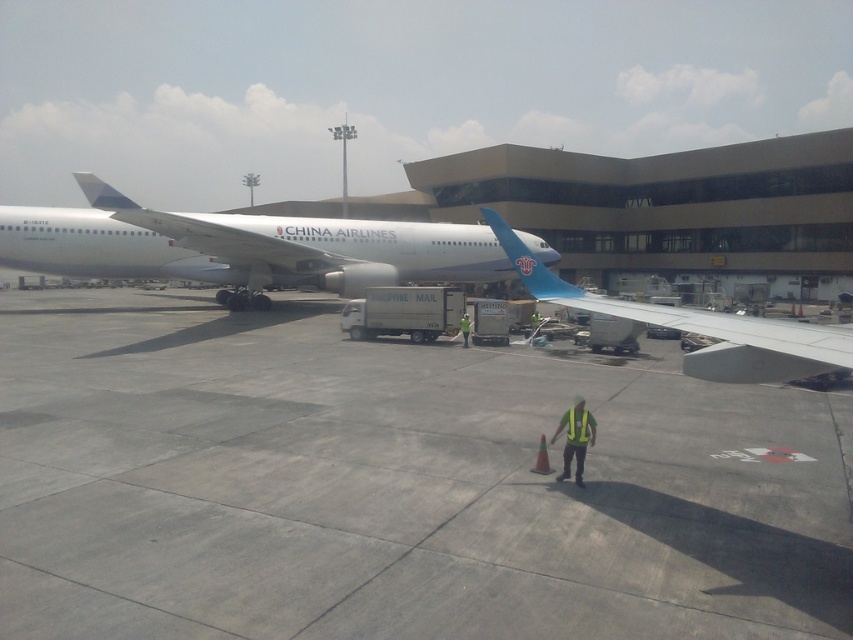
Question: Can you confirm if gray concrete tarmac at center is positioned above white glossy airplane at center?

Choices:
 (A) no
 (B) yes

Answer: (A)

Question: Among these objects, which one is nearest to the camera?

Choices:
 (A) white glossy airplane at center
 (B) green reflective vest at center
 (C) blue glossy wing at center
 (D) gray concrete tarmac at center

Answer: (C)

Question: Which of the following is the farthest from the observer?

Choices:
 (A) yellow reflective safety vest at center
 (B) blue glossy wing at center
 (C) white glossy airplane at center

Answer: (C)

Question: Considering the relative positions of gray concrete tarmac at center and yellow reflective safety vest at center in the image provided, where is gray concrete tarmac at center located with respect to yellow reflective safety vest at center?

Choices:
 (A) right
 (B) left

Answer: (B)

Question: Can you confirm if gray concrete tarmac at center is positioned above yellow reflective safety vest at center?

Choices:
 (A) yes
 (B) no

Answer: (A)

Question: Which point is farther to the camera?

Choices:
 (A) (573, 436)
 (B) (331, 324)
 (C) (233, 216)
 (D) (575, 420)

Answer: (C)